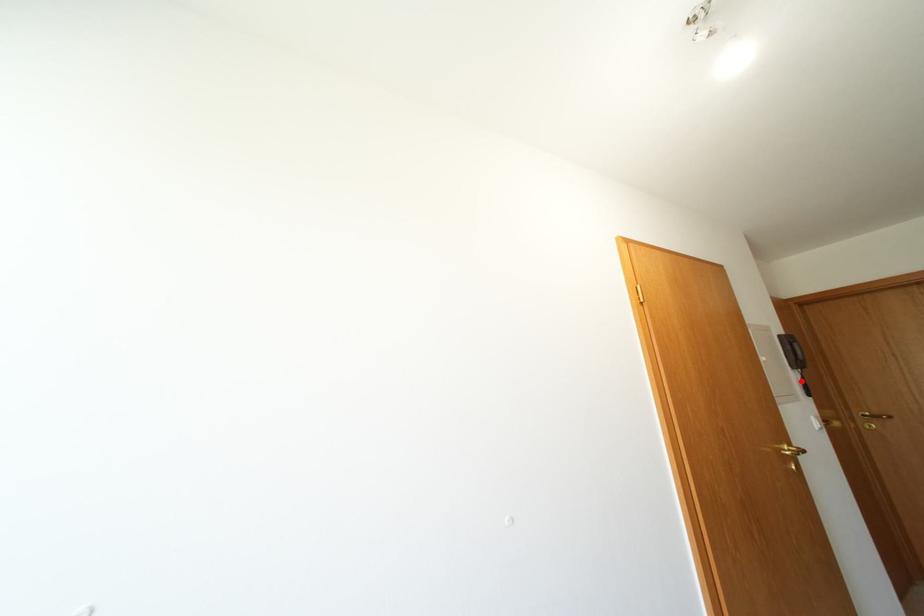
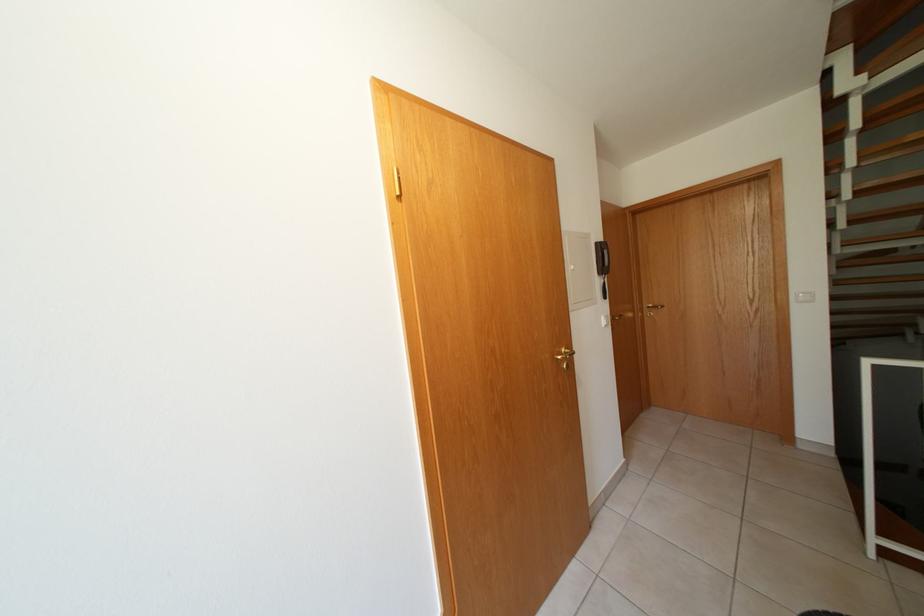
Locate, in the second image, the point that corresponds to the highlighted location in the first image.

(606, 286)